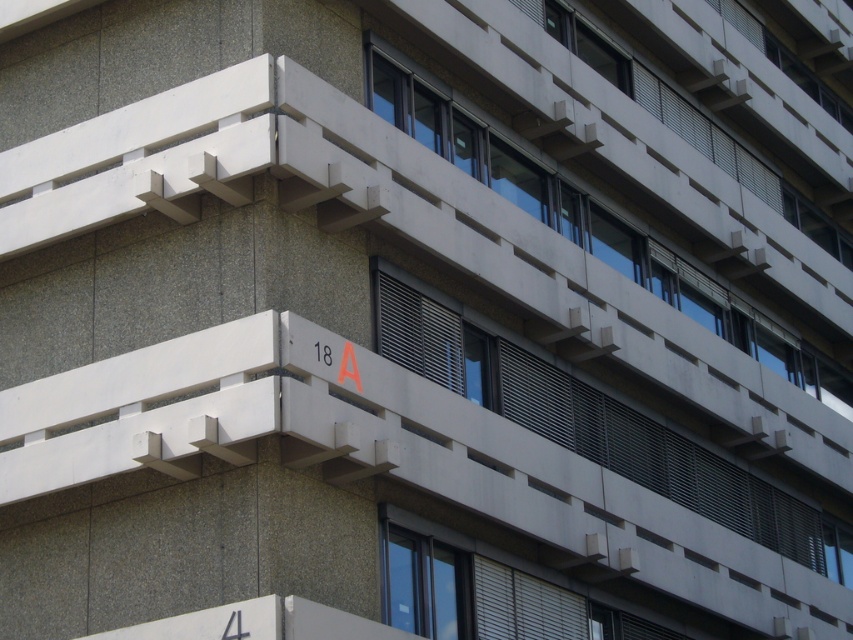
Does point (468, 396) come behind point (704, 285)?

No, (468, 396) is in front of (704, 285).

The height and width of the screenshot is (640, 853). I want to click on white textured window at center, so 590,422.